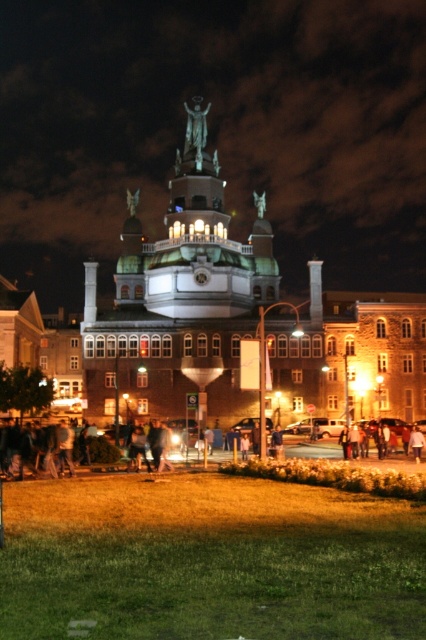
You are standing at the entrance of the grand building and see the dark clothing at lower center and the polished bronze statue at center. Which object is shorter in height?

The dark clothing at lower center is shorter in height compared to the polished bronze statue at center.

You are a photographer setting up a wide shot of the grand building with the polished bronze statue at center and the dark clothing at lower center in the frame. To ensure both objects are fully visible, which object should you prioritize keeping closer to the camera?

The dark clothing at lower center might be wider than polished bronze statue at center, so to ensure both are fully visible in the wide shot, prioritize keeping the dark clothing at lower center closer to the camera since wider objects require more space in the frame.